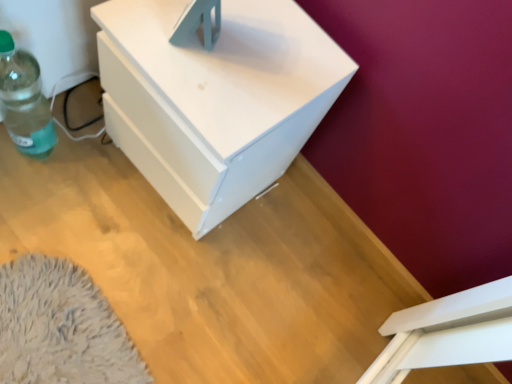
The height and width of the screenshot is (384, 512). In order to click on vacant area located to the right-hand side of green translucent bottle at left in this screenshot , I will do `click(90, 188)`.